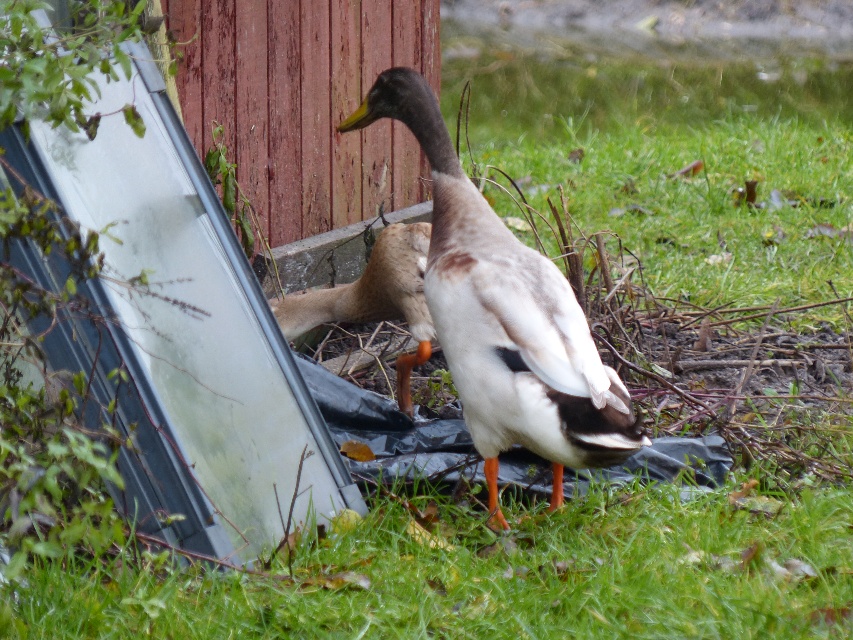
Question: Can you confirm if white matte duck at center is positioned above brown feathered duck at center?

Choices:
 (A) yes
 (B) no

Answer: (A)

Question: Which point is farther from the camera taking this photo?

Choices:
 (A) (450, 280)
 (B) (407, 410)

Answer: (B)

Question: Is white matte duck at center below brown feathered duck at center?

Choices:
 (A) no
 (B) yes

Answer: (A)

Question: Does white matte duck at center have a larger size compared to brown feathered duck at center?

Choices:
 (A) no
 (B) yes

Answer: (B)

Question: Which point is closer to the camera?

Choices:
 (A) click(412, 296)
 (B) click(451, 182)

Answer: (B)